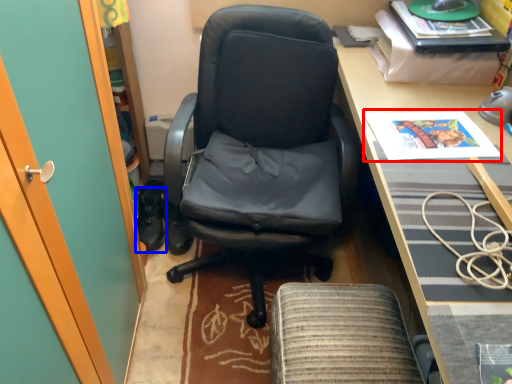
Question: Which of the following is the farthest to the observer, magazine (highlighted by a red box) or footwear (highlighted by a blue box)?

Choices:
 (A) magazine
 (B) footwear

Answer: (B)